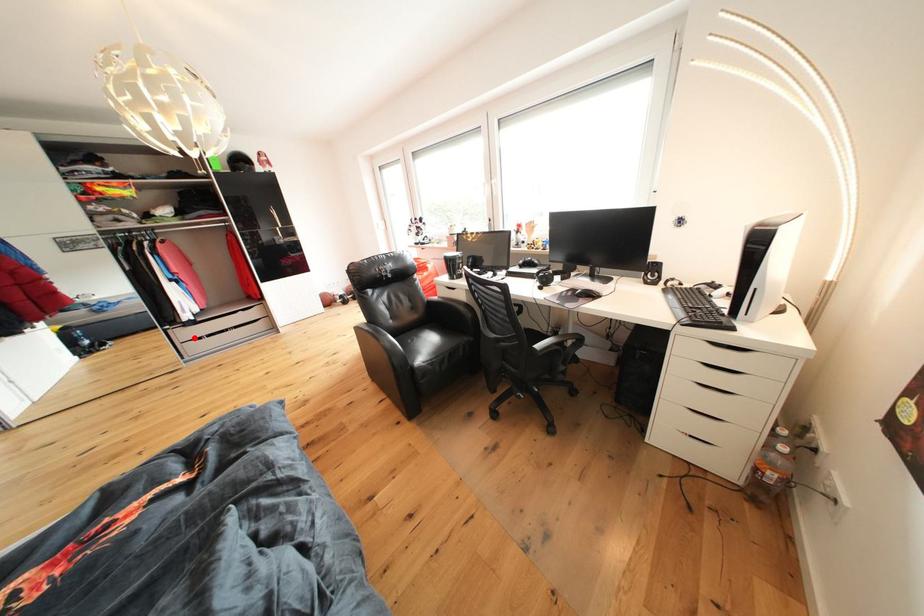
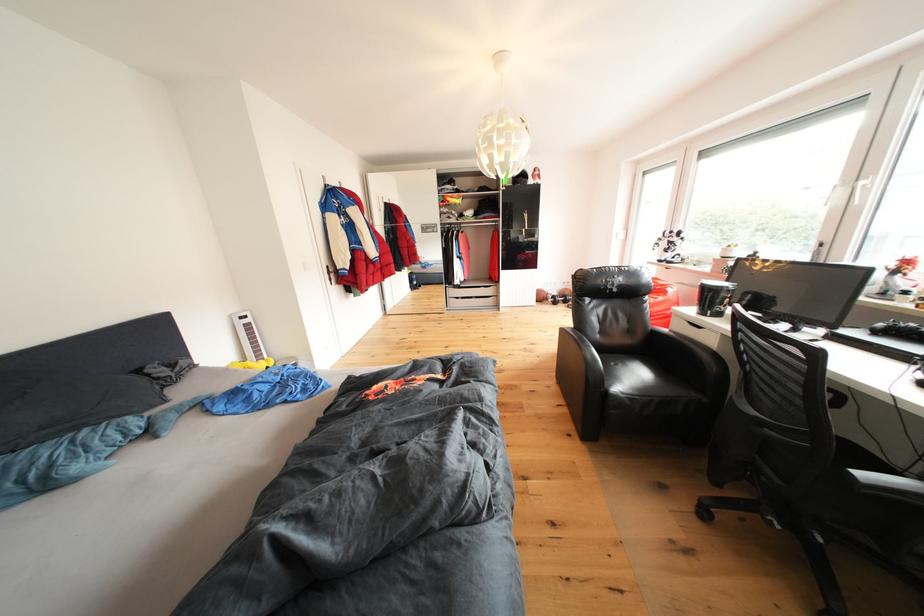
Where in the second image is the point corresponding to the highlighted location from the first image?

(463, 297)